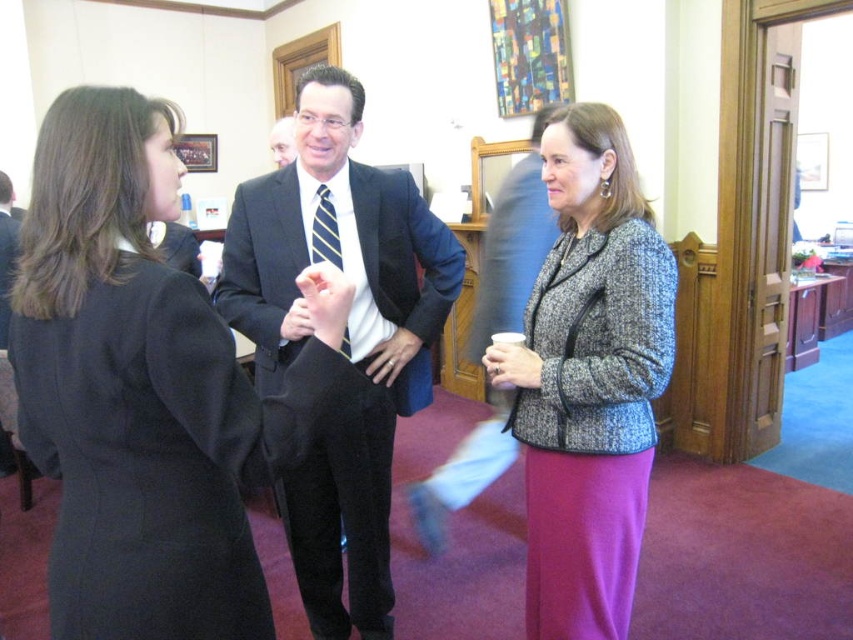
You are standing at the origin of the coordinate system in the image. You want to walk to the black wool coat at left. Which direction should you move relative to the point at coordinate point [129,390]?

The black wool coat at left is located at point [129,390], so you should move towards that coordinate point to reach it.

You are standing in the room and want to hand a document to both the black wool coat at left and the black suit at center. Which one should you approach first to ensure you can reach them without moving past the other?

You should approach the black wool coat at left first because it is closer to you than the black suit at center, so you can reach them without needing to move past the other person.

You are organizing a photo shoot and need to arrange two black outfits in the scene. The black wool coat at left and the black suit at center are already placed. Which outfit takes up more space in the photo?

The black suit at center occupies more space than the black wool coat at left according to the description.